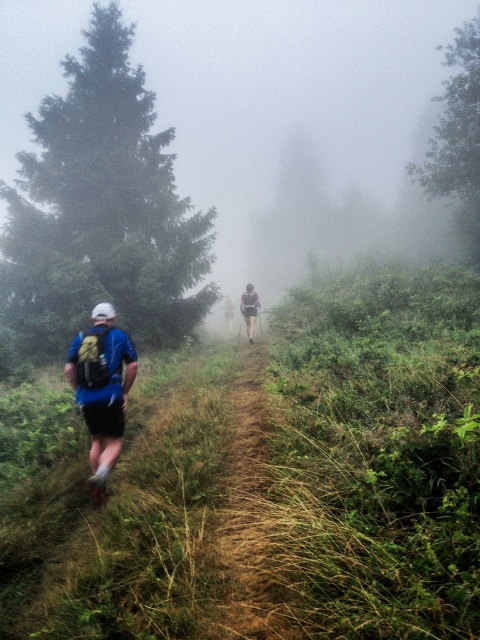
Question: Is blue fabric backpack at left below green fabric backpack at center?

Choices:
 (A) yes
 (B) no

Answer: (A)

Question: Which point appears farthest from the camera in this image?

Choices:
 (A) (250, 304)
 (B) (171, 156)
 (C) (253, 502)

Answer: (B)

Question: Is brown grassy trail at center positioned before blue fabric backpack at left?

Choices:
 (A) yes
 (B) no

Answer: (A)

Question: Which point appears farthest from the camera in this image?

Choices:
 (A) (232, 312)
 (B) (252, 596)

Answer: (A)

Question: Which of the following is the farthest from the observer?

Choices:
 (A) (255, 310)
 (B) (259, 580)
 (C) (116, 451)
 (D) (231, 301)

Answer: (D)

Question: Is brown grassy trail at center above green fabric backpack at center?

Choices:
 (A) yes
 (B) no

Answer: (B)